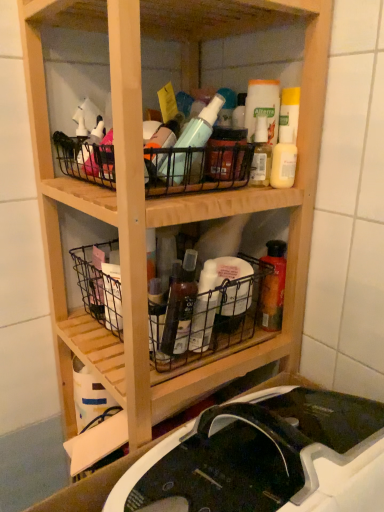
Question: From a real-world perspective, is black wire basket at upper center, acting as the third basket starting from the bottom, positioned over black plastic sink at lower center based on gravity?

Choices:
 (A) yes
 (B) no

Answer: (A)

Question: Is black wire basket at upper center, the first basket from the top, in front of black plastic sink at lower center?

Choices:
 (A) yes
 (B) no

Answer: (B)

Question: Can you confirm if black wire basket at upper center, the first basket from the top, is positioned to the right of black plastic sink at lower center?

Choices:
 (A) yes
 (B) no

Answer: (B)

Question: Does black wire basket at upper center, the first basket from the top, touch black plastic sink at lower center?

Choices:
 (A) yes
 (B) no

Answer: (B)

Question: Does black wire basket at upper center, the first basket from the top, have a lesser height compared to black plastic sink at lower center?

Choices:
 (A) no
 (B) yes

Answer: (B)

Question: Could you tell me if black wire basket at upper center, acting as the third basket starting from the bottom, is facing black plastic sink at lower center?

Choices:
 (A) yes
 (B) no

Answer: (B)

Question: Would you say black plastic sink at lower center is part of translucent plastic bottle at center, which appears as the 2th bottle when viewed from the right,'s contents?

Choices:
 (A) yes
 (B) no

Answer: (B)

Question: Is translucent plastic bottle at center, which appears as the 2th bottle when viewed from the right, turned away from black plastic sink at lower center?

Choices:
 (A) yes
 (B) no

Answer: (B)

Question: Are translucent plastic bottle at center, which is the 1th bottle from left to right, and black plastic sink at lower center located far from each other?

Choices:
 (A) yes
 (B) no

Answer: (B)

Question: Is translucent plastic bottle at center, which is the 1th bottle from left to right, placed right next to black plastic sink at lower center?

Choices:
 (A) no
 (B) yes

Answer: (A)

Question: From a real-world perspective, is translucent plastic bottle at center, which is the 1th bottle from left to right, over black plastic sink at lower center?

Choices:
 (A) no
 (B) yes

Answer: (B)

Question: Is translucent plastic bottle at center, which is the 1th bottle from left to right, taller than black plastic sink at lower center?

Choices:
 (A) yes
 (B) no

Answer: (B)

Question: Is black wire basket at upper center, acting as the third basket starting from the bottom, not close to metallic wire basket at lower left, placed as the 2th basket when sorted from bottom to top?

Choices:
 (A) yes
 (B) no

Answer: (B)